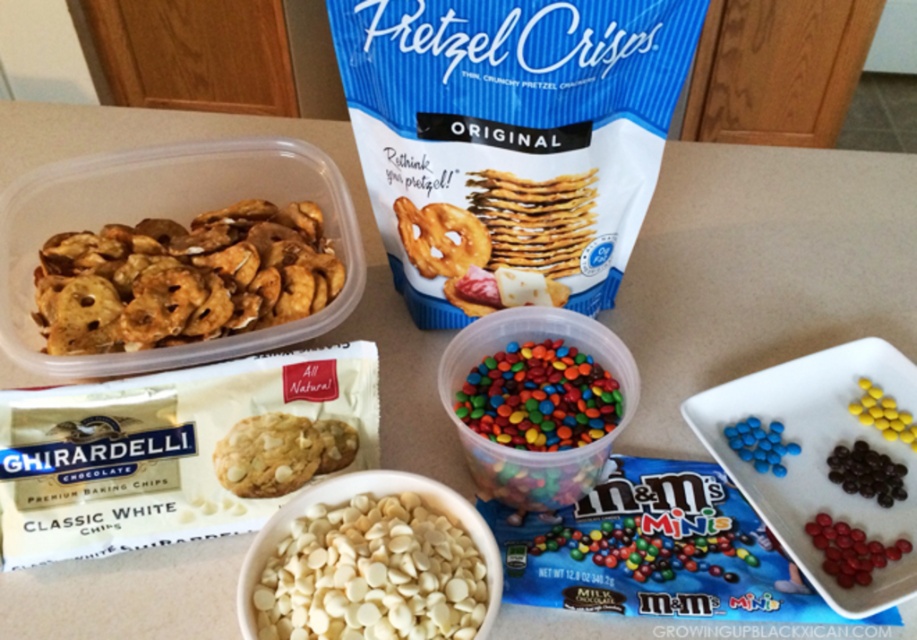
Question: Which point appears closest to the camera in this image?

Choices:
 (A) (415, 250)
 (B) (841, 568)
 (C) (239, 493)

Answer: (B)

Question: Which of the following is the closest to the observer?

Choices:
 (A) white matte chips at center
 (B) multicolored plastic container at center
 (C) caramel-coated pretzels at upper left
 (D) blue matte m&m's at center right

Answer: (A)

Question: Can you confirm if matte brown pretzel at center is thinner than white chocolate chip cookie at center?

Choices:
 (A) no
 (B) yes

Answer: (A)

Question: Can you confirm if caramel-coated pretzels at upper left is positioned to the left of shiny red m&m's at lower right?

Choices:
 (A) yes
 (B) no

Answer: (A)

Question: Among these points, which one is nearest to the camera?

Choices:
 (A) (x=754, y=445)
 (B) (x=308, y=224)
 (C) (x=591, y=240)
 (D) (x=843, y=480)

Answer: (D)

Question: Can you confirm if white matte chips at center is positioned to the right of shiny multicolored m&m's at center?

Choices:
 (A) yes
 (B) no

Answer: (B)